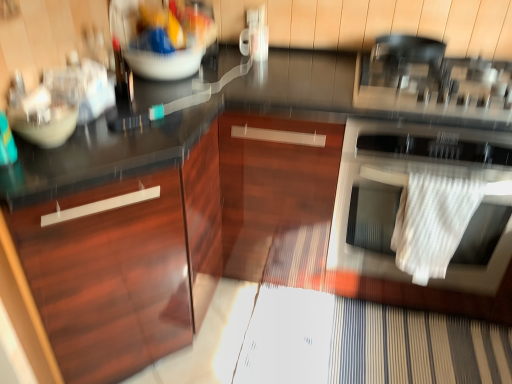
Identify the location of free space in front of matte white bowl at left. This screenshot has width=512, height=384. (44, 168).